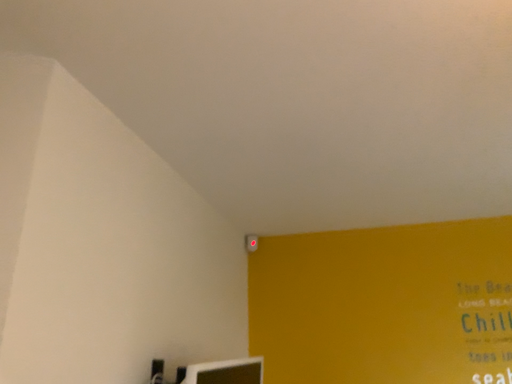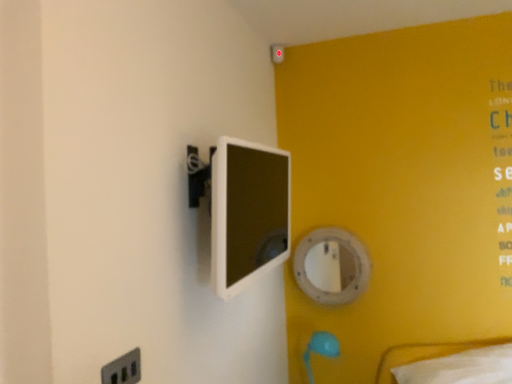
Question: How did the camera likely rotate when shooting the video?

Choices:
 (A) rotated upward
 (B) rotated downward

Answer: (B)